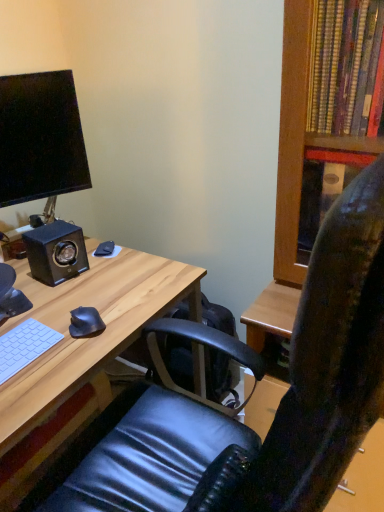
At what (x,y) coordinates should I click in order to perform the action: click on free space to the left of black matte speaker at left. Please return your answer as a coordinate pair (x, y). Looking at the image, I should click on (20, 272).